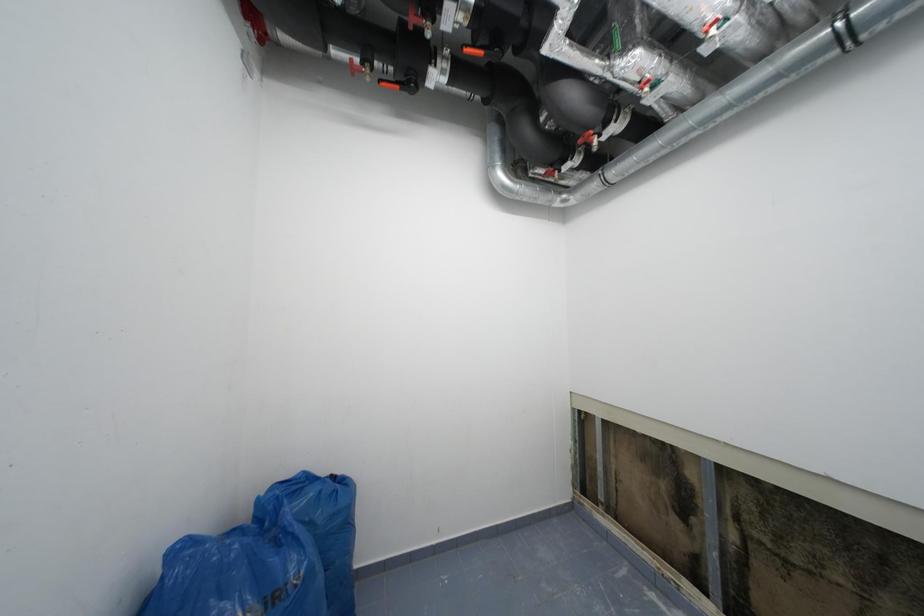
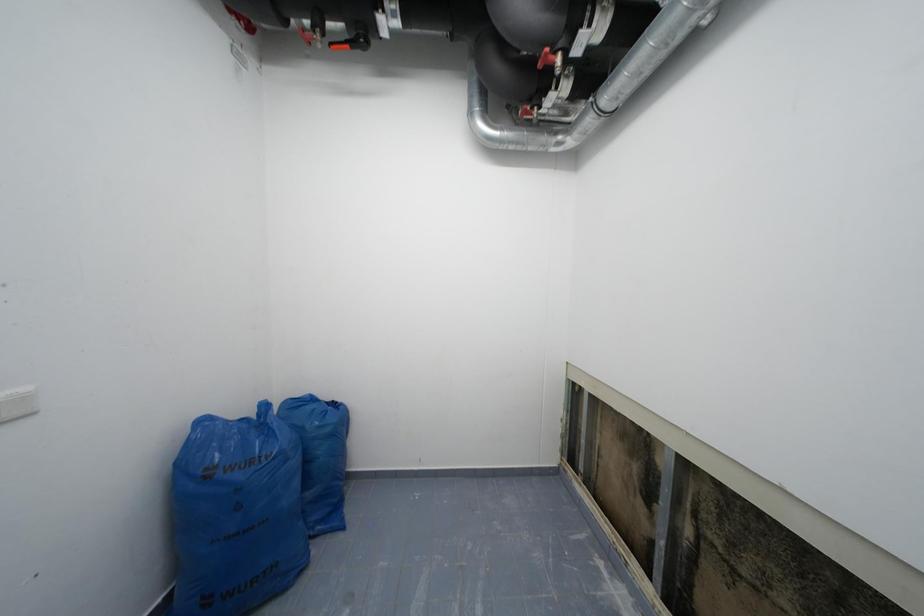
Question: What movement of the cameraman would produce the second image?

Choices:
 (A) Left
 (B) Right
 (C) Forward
 (D) Backward

Answer: (B)